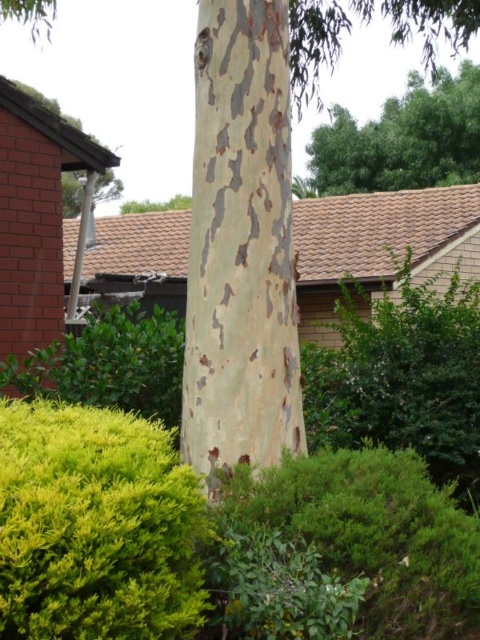
Which is in front, point (288, 273) or point (296, 630)?

Point (296, 630)

Is point (226, 326) more distant than point (272, 580)?

Yes, point (226, 326) is farther from viewer.

Does point (287, 371) come behind point (300, 474)?

That is True.

Locate an element on the screen. The image size is (480, 640). speckled bark tree trunk at center is located at coordinates (240, 244).

Does yellow-green textured bush at lower left appear under green leafy tree at upper center?

Indeed, yellow-green textured bush at lower left is positioned under green leafy tree at upper center.

At what (x,y) coordinates should I click in order to perform the action: click on yellow-green textured bush at lower left. Please return your answer as a coordinate pair (x, y). The image size is (480, 640). Looking at the image, I should click on (96, 525).

Between point (228, 497) and point (433, 349), which one is positioned behind?

The point (433, 349) is behind.

Can you confirm if green leafy bush at lower center is positioned above green leafy bush at center?

Incorrect, green leafy bush at lower center is not positioned above green leafy bush at center.

Is point (322, 532) closer to camera compared to point (324, 378)?

That is True.

This screenshot has width=480, height=640. What are the coordinates of `green leafy bush at lower center` in the screenshot? It's located at (344, 552).